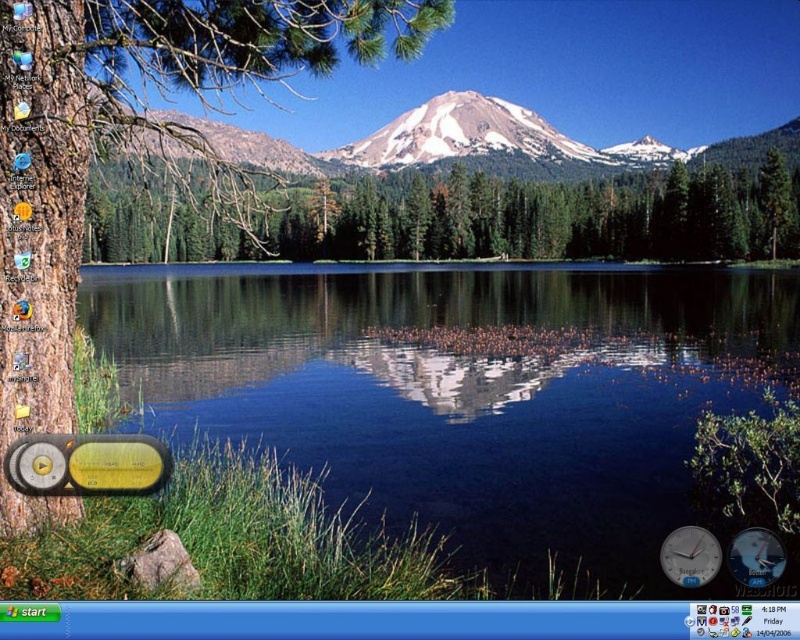
Does point (401, 248) come closer to viewer compared to point (528, 138)?

Yes.

Who is shorter, green matte tree at center or snowy granite mountain at center?

green matte tree at center

You are a GUI agent. You are given a task and a screenshot of the screen. Output one action in this format:
    pyautogui.click(x=<x>, y=<y>)
    Task: Click on the green matte tree at center
    The image size is (800, 640).
    Given the screenshot: What is the action you would take?
    pyautogui.click(x=548, y=216)

At what (x,y) coordinates should I click in order to perform the action: click on green matte tree at center. Please return your answer as a coordinate pair (x, y). Image resolution: width=800 pixels, height=640 pixels. Looking at the image, I should click on (548, 216).

Which is in front, point (30, 218) or point (504, 212)?

Positioned in front is point (30, 218).

Is brown rough bark tree at left further to camera compared to green matte tree at center?

That is False.

Does point (38, 16) come farther from viewer compared to point (294, 253)?

No, it is in front of (294, 253).

This screenshot has width=800, height=640. What are the coordinates of `brown rough bark tree at left` in the screenshot? It's located at (130, 132).

Between clear water at center and green matte tree at center, which one appears on the left side from the viewer's perspective?

Answer: clear water at center is more to the left.

Does clear water at center appear on the left side of green matte tree at center?

Correct, you'll find clear water at center to the left of green matte tree at center.

Between point (298, 422) and point (476, 209), which one is positioned in front?

Point (298, 422) is in front.

You are a GUI agent. You are given a task and a screenshot of the screen. Output one action in this format:
    pyautogui.click(x=<x>, y=<y>)
    Task: Click on the clear water at center
    The image size is (800, 640).
    Given the screenshot: What is the action you would take?
    pyautogui.click(x=462, y=392)